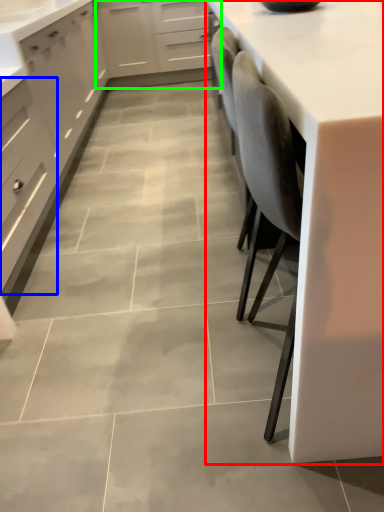
Question: Which object is positioned closest to countertop (highlighted by a red box)? Select from drawer (highlighted by a blue box) and cabinetry (highlighted by a green box).

Choices:
 (A) drawer
 (B) cabinetry

Answer: (A)